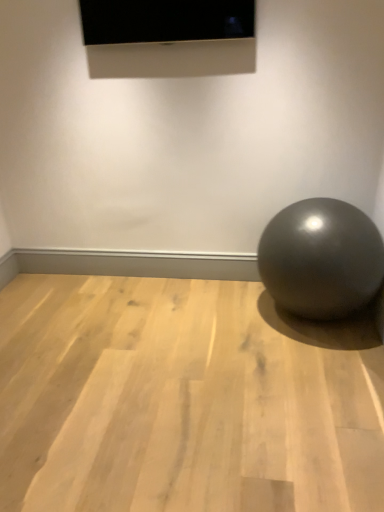
The width and height of the screenshot is (384, 512). Identify the location of vacant region to the left of glossy metallic ball at lower right. (225, 326).